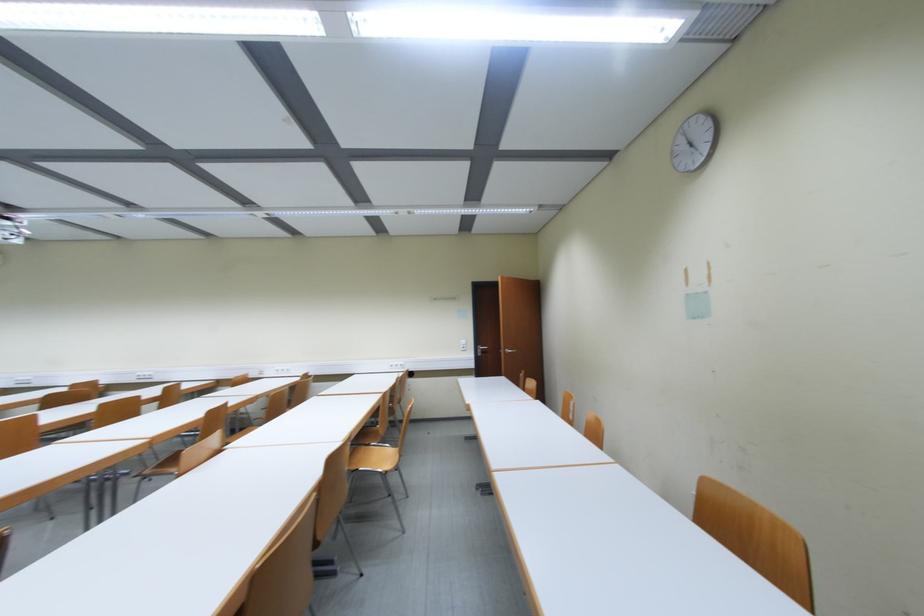
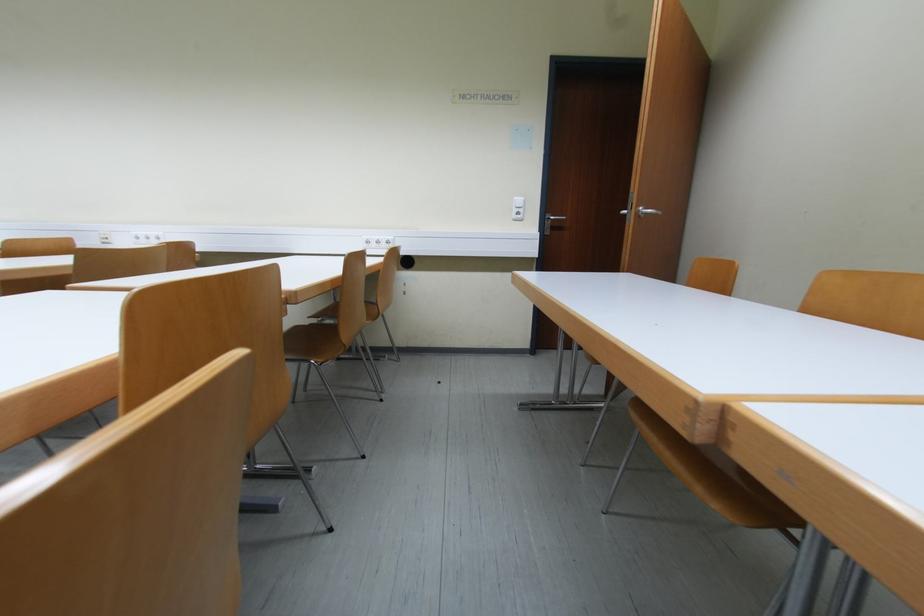
Question: What movement of the cameraman would produce the second image?

Choices:
 (A) Left
 (B) Right
 (C) Forward
 (D) Backward

Answer: (C)